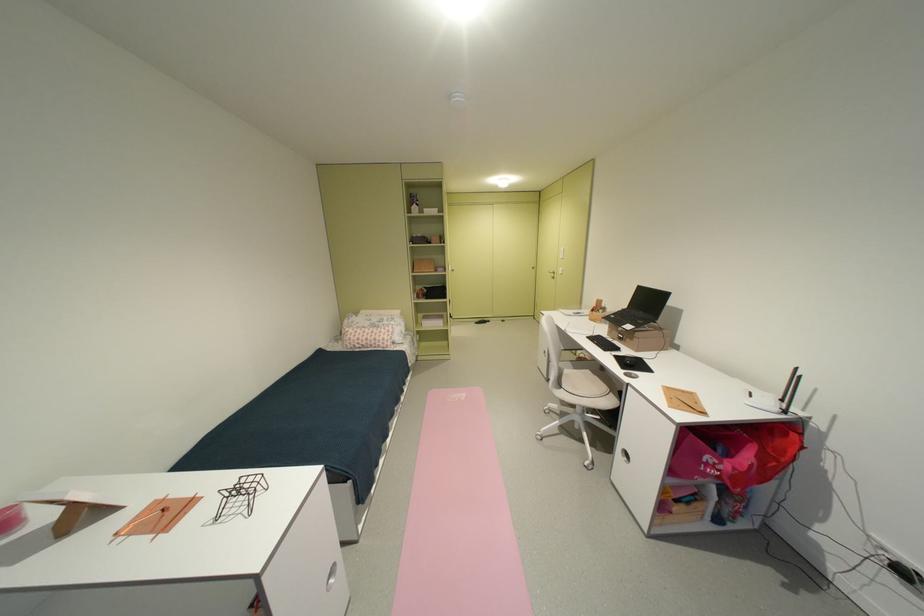
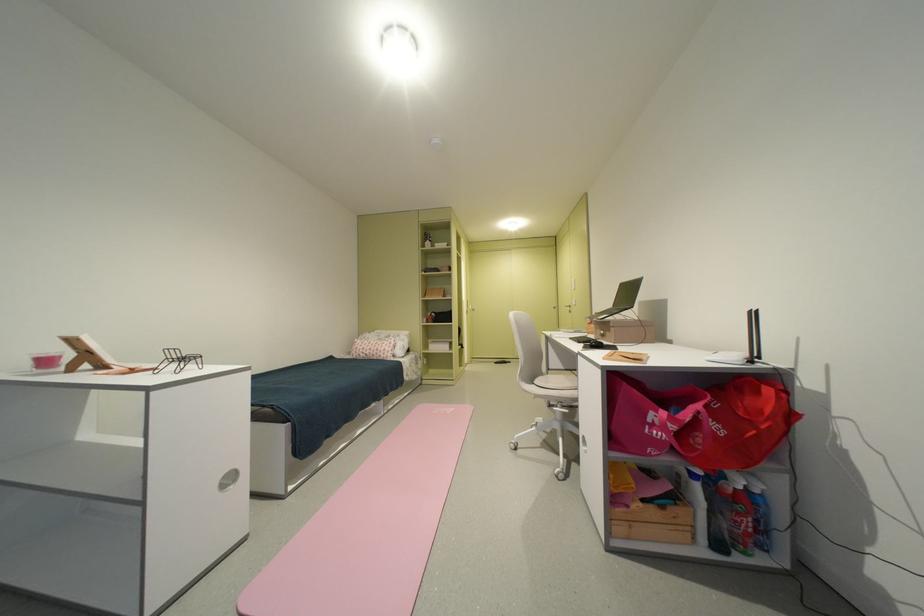
In the second image, find the point that corresponds to point 388,342 in the first image.

(390, 352)